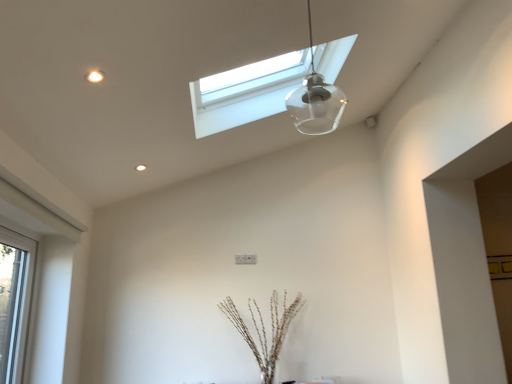
Question: Is clear glass window at left, the 2th window in the top-to-bottom sequence, next to brown textured sticks at center and touching it?

Choices:
 (A) yes
 (B) no

Answer: (B)

Question: Is clear glass window at left, the first window viewed from the left, positioned with its back to brown textured sticks at center?

Choices:
 (A) no
 (B) yes

Answer: (A)

Question: Considering the relative sizes of clear glass window at left, the second window in the right-to-left sequence, and brown textured sticks at center in the image provided, is clear glass window at left, the second window in the right-to-left sequence, smaller than brown textured sticks at center?

Choices:
 (A) no
 (B) yes

Answer: (B)

Question: From a real-world perspective, does clear glass window at left, the 2th window in the top-to-bottom sequence, sit lower than brown textured sticks at center?

Choices:
 (A) yes
 (B) no

Answer: (B)

Question: Is clear glass window at left, the 2th window in the top-to-bottom sequence, taller than brown textured sticks at center?

Choices:
 (A) no
 (B) yes

Answer: (B)

Question: Based on their sizes in the image, would you say brown textured sticks at center is bigger or smaller than clear glass window at left, the first window viewed from the left?

Choices:
 (A) small
 (B) big

Answer: (B)

Question: Does point (276, 302) appear closer or farther from the camera than point (2, 332)?

Choices:
 (A) closer
 (B) farther

Answer: (B)

Question: From a real-world perspective, is brown textured sticks at center above or below clear glass window at left, which is the 1th window from bottom to top?

Choices:
 (A) below
 (B) above

Answer: (A)

Question: In the image, is brown textured sticks at center positioned in front of or behind clear glass window at left, the second window in the right-to-left sequence?

Choices:
 (A) behind
 (B) front

Answer: (A)

Question: Considering the positions of clear glass window at left, the first window viewed from the left, and transparent glass pendant light at upper center in the image, is clear glass window at left, the first window viewed from the left, wider or thinner than transparent glass pendant light at upper center?

Choices:
 (A) thin
 (B) wide

Answer: (B)

Question: In the image, is clear glass window at left, the first window viewed from the left, on the left side or the right side of transparent glass pendant light at upper center?

Choices:
 (A) right
 (B) left

Answer: (B)

Question: Is clear glass window at left, the first window viewed from the left, taller or shorter than transparent glass pendant light at upper center?

Choices:
 (A) short
 (B) tall

Answer: (B)

Question: Choose the correct answer: Is clear glass window at left, the first window viewed from the left, inside transparent glass pendant light at upper center or outside it?

Choices:
 (A) outside
 (B) inside

Answer: (A)

Question: Is point (263, 334) positioned closer to the camera than point (295, 109)?

Choices:
 (A) closer
 (B) farther

Answer: (B)

Question: In the image, is brown textured sticks at center positioned in front of or behind transparent glass pendant light at upper center?

Choices:
 (A) behind
 (B) front

Answer: (A)